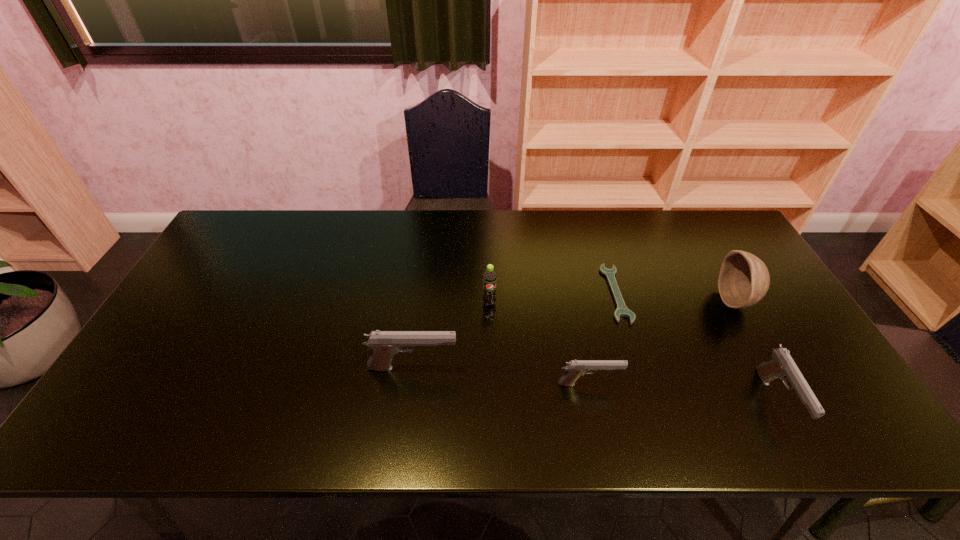
Where is `blank region between the third shortest object and the fourth object from right to left`? The width and height of the screenshot is (960, 540). blank region between the third shortest object and the fourth object from right to left is located at coordinates (683, 393).

Locate an element on the screen. The width and height of the screenshot is (960, 540). object that stands as the fourth closest to the leftmost object is located at coordinates tap(782, 366).

The height and width of the screenshot is (540, 960). Identify the location of object identified as the fifth closest to the leftmost object. (744, 279).

Locate which pistol ranks third in proximity to the wrench. Please provide its 2D coordinates. Your answer should be formatted as a tuple, i.e. [(x, y)], where the tuple contains the x and y coordinates of a point satisfying the conditions above.

[(385, 344)]

Identify the location of the second closest pistol relative to the fifth object from right to left. (575, 368).

The height and width of the screenshot is (540, 960). I want to click on free space that satisfies the following two spatial constraints: 1. on the front side of the bowl; 2. at the barrel of the second shortest object, so click(x=783, y=384).

Where is `vacant space that satisfies the following two spatial constraints: 1. on the front label of the fifth object from right to left; 2. at the barrel of the leftmost object`? vacant space that satisfies the following two spatial constraints: 1. on the front label of the fifth object from right to left; 2. at the barrel of the leftmost object is located at coordinates (491, 368).